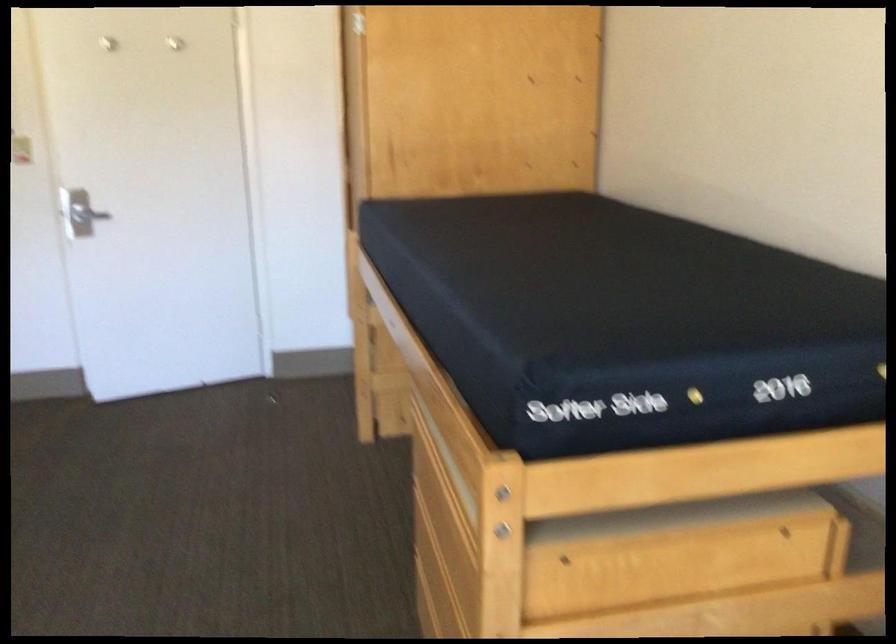
This screenshot has width=896, height=644. I want to click on light switch, so click(x=21, y=149).